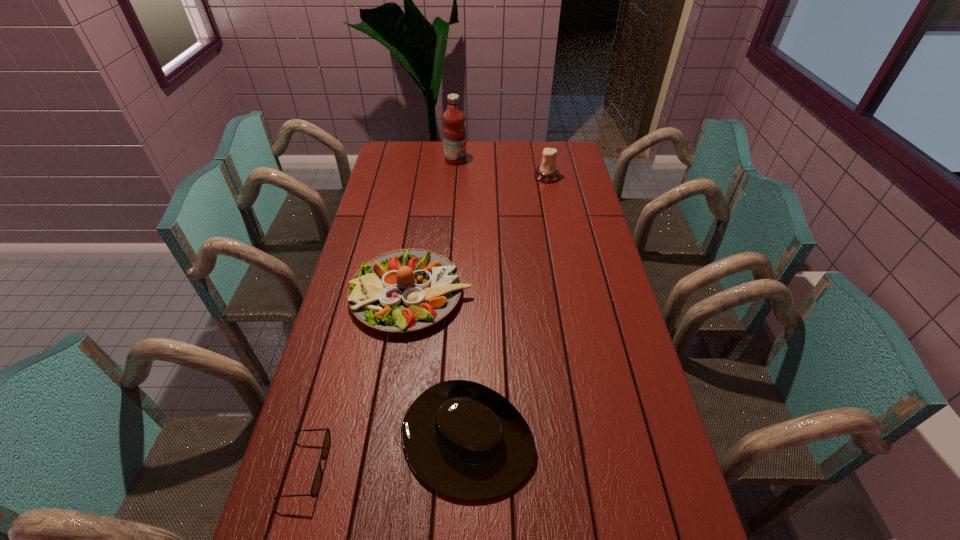
Identify the location of free space located on the front of the third farthest object. The image size is (960, 540). (389, 443).

This screenshot has height=540, width=960. In order to click on vacant region located 0.190m on the left of the second shortest object in this screenshot , I will do `click(321, 441)`.

Locate an element on the screen. This screenshot has height=540, width=960. vacant position located on the front-facing side of the shortest object is located at coordinates (365, 468).

At what (x,y) coordinates should I click in order to perform the action: click on object situated at the far edge. Please return your answer as a coordinate pair (x, y). The width and height of the screenshot is (960, 540). Looking at the image, I should click on point(454,132).

Identify the location of salad plate that is at the left edge. The height and width of the screenshot is (540, 960). (407, 290).

The image size is (960, 540). I want to click on sunglasses positioned at the left edge, so click(316, 484).

Where is `object located at the right edge`? object located at the right edge is located at coordinates (547, 172).

Image resolution: width=960 pixels, height=540 pixels. What are the coordinates of `free point at the far edge` in the screenshot? It's located at (518, 151).

Locate an element on the screen. free space at the left edge of the desktop is located at coordinates (394, 199).

What are the coordinates of `free space at the right edge` in the screenshot? It's located at (572, 191).